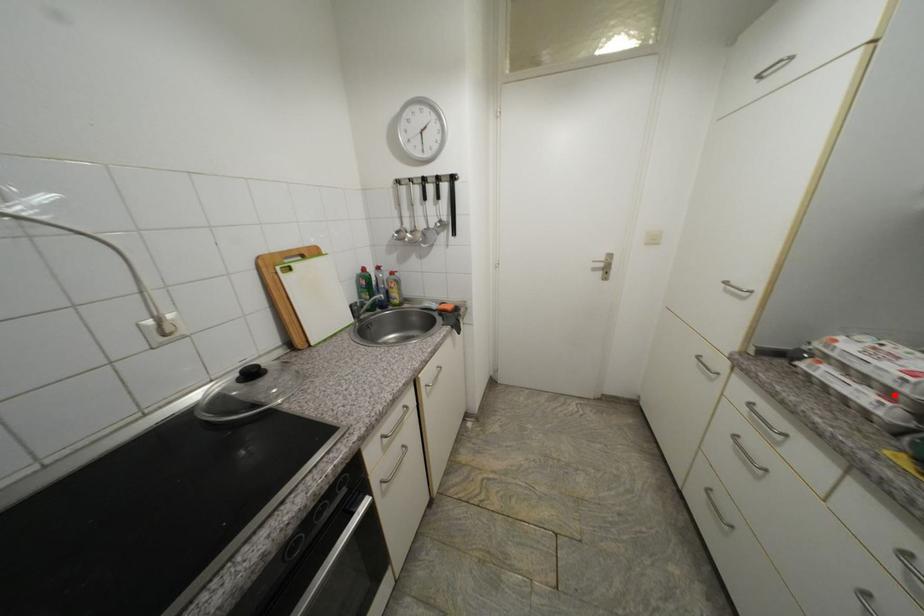
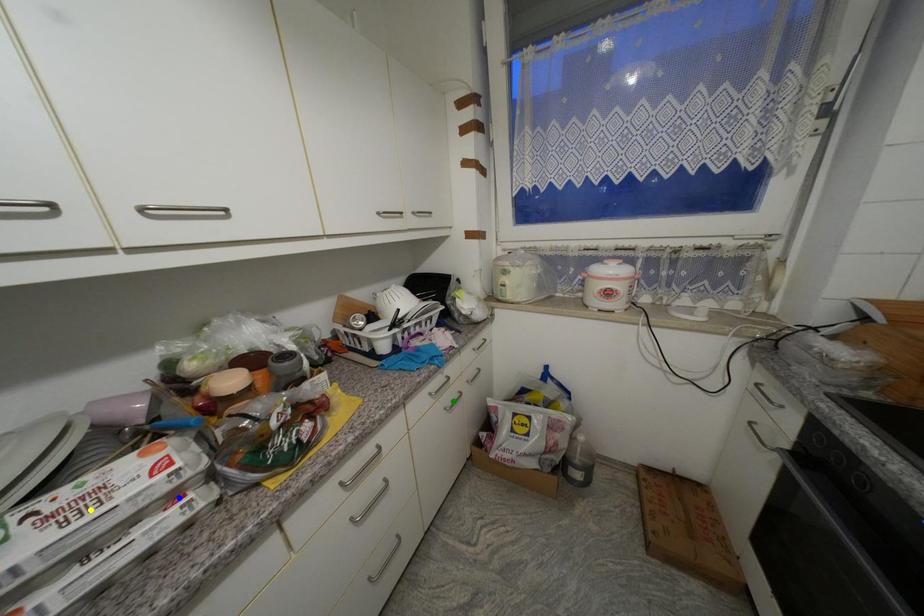
Question: I am providing you with two images of the same scene from different viewpoints. A red point is marked on the first image. You are given multiple points on the second image. Can you choose the point in image 2 that corresponds to the point in image 1?

Choices:
 (A) blue point
 (B) green point
 (C) yellow point

Answer: (A)